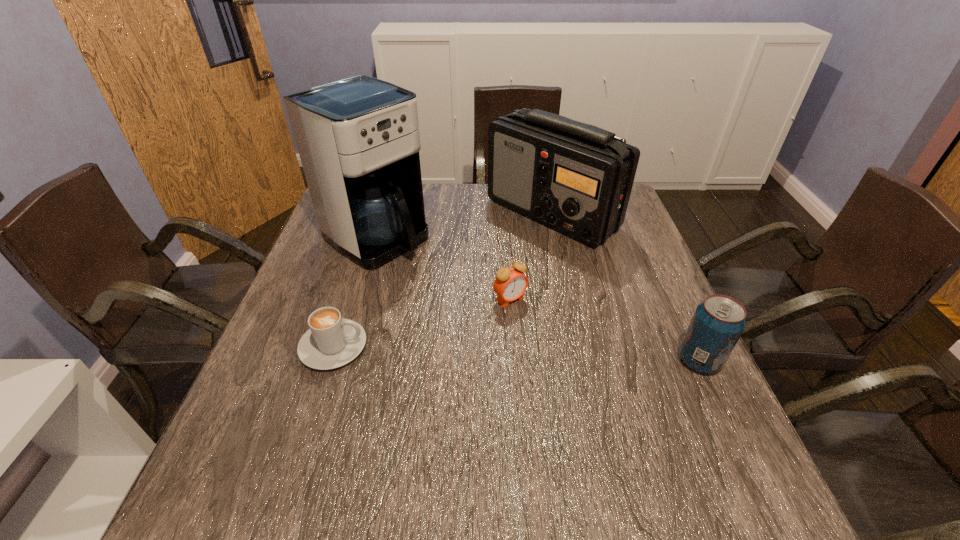
Find the location of a particular element. This screenshot has height=540, width=960. free region located 0.350m on the front panel of the coffee maker is located at coordinates (510, 325).

Find the location of a particular element. This screenshot has width=960, height=540. vacant area located 0.270m on the front panel of the coffee maker is located at coordinates (484, 307).

Identify the location of free location located on the front panel of the fourth shortest object. (532, 301).

The width and height of the screenshot is (960, 540). In order to click on blank space located on the front panel of the fourth shortest object in this screenshot , I will do `click(530, 313)`.

At what (x,y) coordinates should I click in order to perform the action: click on free location located on the front panel of the fourth shortest object. Please return your answer as a coordinate pair (x, y). Image resolution: width=960 pixels, height=540 pixels. Looking at the image, I should click on (535, 290).

The height and width of the screenshot is (540, 960). I want to click on free space located 0.100m on the face of the fourth tallest object, so click(x=547, y=334).

Find the location of a particular element. vacant space situated on the face of the fourth tallest object is located at coordinates (609, 395).

You are a GUI agent. You are given a task and a screenshot of the screen. Output one action in this format:
    pyautogui.click(x=<x>, y=<y>)
    Task: Click on the vacant space located on the face of the fourth tallest object
    The image size is (960, 540).
    Given the screenshot: What is the action you would take?
    pyautogui.click(x=574, y=361)

Find the location of a particular element. coffee maker that is at the far edge is located at coordinates (358, 139).

Locate an element on the screen. This screenshot has width=960, height=540. radio receiver situated at the far edge is located at coordinates (576, 178).